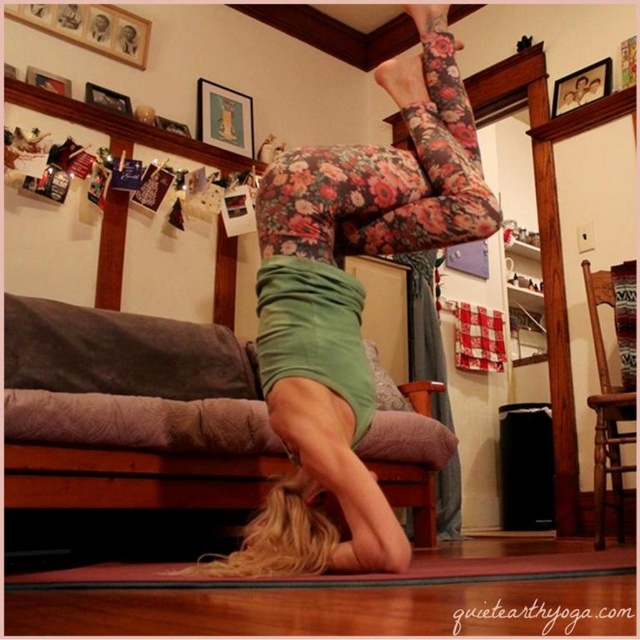
Question: Which of the following is the farthest from the observer?

Choices:
 (A) (292, 580)
 (B) (452, 198)

Answer: (B)

Question: Is floral leggings at center above red rubber mat at lower center?

Choices:
 (A) yes
 (B) no

Answer: (A)

Question: Which point is farther to the camera?

Choices:
 (A) red rubber mat at lower center
 (B) floral leggings at center

Answer: (B)

Question: Is the position of floral leggings at center more distant than that of red rubber mat at lower center?

Choices:
 (A) yes
 (B) no

Answer: (A)

Question: Which object is closer to the camera taking this photo?

Choices:
 (A) red rubber mat at lower center
 (B) floral leggings at center

Answer: (A)

Question: Can you confirm if floral leggings at center is thinner than red rubber mat at lower center?

Choices:
 (A) no
 (B) yes

Answer: (B)